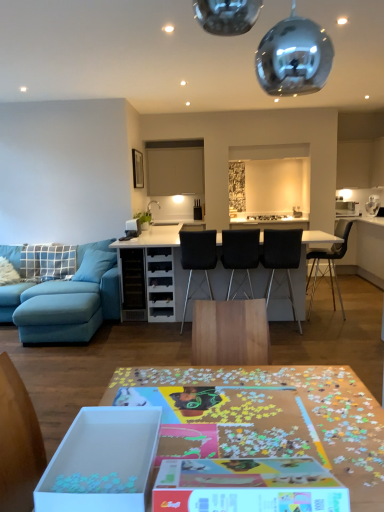
Question: Does white cardboard box at lower left have a larger size compared to black fabric chair at center, positioned as the first chair in left-to-right order?

Choices:
 (A) yes
 (B) no

Answer: (B)

Question: Would you say white cardboard box at lower left is outside black fabric chair at center, positioned as the first chair in left-to-right order?

Choices:
 (A) yes
 (B) no

Answer: (A)

Question: Is black fabric chair at center, positioned as the first chair in left-to-right order, inside white cardboard box at lower left?

Choices:
 (A) no
 (B) yes

Answer: (A)

Question: Considering the relative sizes of white cardboard box at lower left and black fabric chair at center, positioned as the first chair in left-to-right order, in the image provided, is white cardboard box at lower left smaller than black fabric chair at center, positioned as the first chair in left-to-right order,?

Choices:
 (A) yes
 (B) no

Answer: (A)

Question: From a real-world perspective, does white cardboard box at lower left sit lower than black fabric chair at center, positioned as the first chair in left-to-right order?

Choices:
 (A) no
 (B) yes

Answer: (A)

Question: In terms of height, does white cardboard box at lower left look taller or shorter compared to white glossy table at center, which is the 1th table in back-to-front order?

Choices:
 (A) short
 (B) tall

Answer: (A)

Question: Is white cardboard box at lower left wider or thinner than white glossy table at center, which is the 1th table in back-to-front order?

Choices:
 (A) thin
 (B) wide

Answer: (A)

Question: From a real-world perspective, is white cardboard box at lower left physically located above or below white glossy table at center, which is the 1th table in back-to-front order?

Choices:
 (A) above
 (B) below

Answer: (A)

Question: In terms of size, does white cardboard box at lower left appear bigger or smaller than white glossy table at center, arranged as the 2th table when viewed from the front?

Choices:
 (A) small
 (B) big

Answer: (A)

Question: From the image's perspective, relative to black fabric chair at center, the 4th chair viewed from the right, is white glossy table at center, which is the 1th table in back-to-front order, above or below?

Choices:
 (A) below
 (B) above

Answer: (A)

Question: Visually, is white glossy table at center, arranged as the 2th table when viewed from the front, positioned to the left or to the right of black fabric chair at center, the 4th chair viewed from the right?

Choices:
 (A) right
 (B) left

Answer: (A)

Question: Is white glossy table at center, which is the 1th table in back-to-front order, wider or thinner than black fabric chair at center, positioned as the first chair in left-to-right order?

Choices:
 (A) wide
 (B) thin

Answer: (A)

Question: In terms of size, does white glossy table at center, which is the 1th table in back-to-front order, appear bigger or smaller than black fabric chair at center, the 4th chair viewed from the right?

Choices:
 (A) big
 (B) small

Answer: (A)

Question: From a real-world perspective, is black fabric chair at center, the 4th chair viewed from the right, positioned above or below blue fabric pillow at left, which is the first pillow in left-to-right order?

Choices:
 (A) below
 (B) above

Answer: (A)

Question: Is black fabric chair at center, the 4th chair viewed from the right, to the left or to the right of blue fabric pillow at left, which is the first pillow in left-to-right order, in the image?

Choices:
 (A) right
 (B) left

Answer: (A)